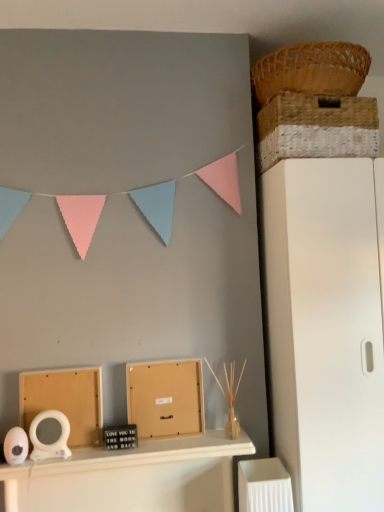
What do you see at coordinates (165, 398) in the screenshot? This screenshot has height=512, width=384. I see `matte cardboard box at center, acting as the first cardboard box starting from the right` at bounding box center [165, 398].

What do you see at coordinates (131, 477) in the screenshot?
I see `white glossy mirror at center` at bounding box center [131, 477].

I want to click on matte cardboard box at lower left, arranged as the second cardboard box when viewed from the right, so click(x=65, y=401).

Considering the points (77, 378) and (184, 422), which point is in front, point (77, 378) or point (184, 422)?

The point (77, 378) is in front.

Does matte cardboard box at lower left, arranged as the second cardboard box when viewed from the right, contain matte cardboard box at center, acting as the second cardboard box starting from the left?

No.

This screenshot has height=512, width=384. I want to click on cardboard box in front of the matte cardboard box at center, acting as the second cardboard box starting from the left, so click(65, 401).

Is matte cardboard box at center, acting as the first cardboard box starting from the right, to the right of white matte file cabinet at right from the viewer's perspective?

Incorrect, matte cardboard box at center, acting as the first cardboard box starting from the right, is not on the right side of white matte file cabinet at right.

Between matte cardboard box at center, acting as the first cardboard box starting from the right, and white matte file cabinet at right, which one has smaller size?

matte cardboard box at center, acting as the first cardboard box starting from the right.

Does matte cardboard box at lower left, which is the 1th cardboard box in left-to-right order, have a greater height compared to woven straw basket at upper right, the 1th basket ordered from the bottom?

Indeed, matte cardboard box at lower left, which is the 1th cardboard box in left-to-right order, has a greater height compared to woven straw basket at upper right, the 1th basket ordered from the bottom.

Looking at this image, from a real-world perspective, is matte cardboard box at lower left, arranged as the second cardboard box when viewed from the right, above or below woven straw basket at upper right, the 1th basket ordered from the bottom?

matte cardboard box at lower left, arranged as the second cardboard box when viewed from the right, is below woven straw basket at upper right, the 1th basket ordered from the bottom.

Considering the points (21, 404) and (295, 106), which point is behind, point (21, 404) or point (295, 106)?

Point (295, 106)

This screenshot has height=512, width=384. In order to click on basket that is the 1st one when counting upward from the matte cardboard box at lower left, arranged as the second cardboard box when viewed from the right (from the image's perspective) in this screenshot , I will do `click(315, 112)`.

Looking at this image, is woven brown basket at upper right, which is the 1th basket from top to bottom, behind white matte file cabinet at right?

Yes, it is behind white matte file cabinet at right.

From a real-world perspective, who is located lower, woven brown basket at upper right, which is the 1th basket from top to bottom, or white matte file cabinet at right?

white matte file cabinet at right, from a real-world perspective.

Considering the relative positions of woven brown basket at upper right, which is the 1th basket from top to bottom, and white matte file cabinet at right in the image provided, is woven brown basket at upper right, which is the 1th basket from top to bottom, to the right of white matte file cabinet at right from the viewer's perspective?

Incorrect, woven brown basket at upper right, which is the 1th basket from top to bottom, is not on the right side of white matte file cabinet at right.

Which is nearer, (340, 45) or (346, 348)?

Clearly, point (340, 45) is more distant from the camera than point (346, 348).

How different are the orientations of woven brown basket at upper right, which ranks as the second basket in bottom-to-top order, and matte cardboard box at lower left, arranged as the second cardboard box when viewed from the right, in degrees?

0.828 degrees separate the facing orientations of woven brown basket at upper right, which ranks as the second basket in bottom-to-top order, and matte cardboard box at lower left, arranged as the second cardboard box when viewed from the right.

Between woven brown basket at upper right, which is the 1th basket from top to bottom, and matte cardboard box at lower left, which is the 1th cardboard box in left-to-right order, which one has larger size?

woven brown basket at upper right, which is the 1th basket from top to bottom.

From the image's perspective, is woven brown basket at upper right, which is the 1th basket from top to bottom, located above matte cardboard box at lower left, arranged as the second cardboard box when viewed from the right?

Yes, from the image's perspective, woven brown basket at upper right, which is the 1th basket from top to bottom, is above matte cardboard box at lower left, arranged as the second cardboard box when viewed from the right.

Is woven brown basket at upper right, which is the 1th basket from top to bottom, oriented towards matte cardboard box at lower left, arranged as the second cardboard box when viewed from the right?

No, woven brown basket at upper right, which is the 1th basket from top to bottom, is not aimed at matte cardboard box at lower left, arranged as the second cardboard box when viewed from the right.

In the scene shown: Is the depth of matte cardboard box at center, acting as the first cardboard box starting from the right, less than that of woven straw basket at upper right, the 1th basket ordered from the bottom?

No.

The image size is (384, 512). In order to click on basket that is the 2nd one when counting rightward from the matte cardboard box at center, acting as the first cardboard box starting from the right in this screenshot , I will do coord(315,112).

Considering the relative sizes of matte cardboard box at center, acting as the first cardboard box starting from the right, and woven straw basket at upper right, which appears as the 2th basket when viewed from the top, in the image provided, is matte cardboard box at center, acting as the first cardboard box starting from the right, shorter than woven straw basket at upper right, which appears as the 2th basket when viewed from the top,?

No, matte cardboard box at center, acting as the first cardboard box starting from the right, is not shorter than woven straw basket at upper right, which appears as the 2th basket when viewed from the top.

Is matte cardboard box at center, acting as the second cardboard box starting from the left, wider or thinner than woven straw basket at upper right, which appears as the 2th basket when viewed from the top?

Considering their sizes, matte cardboard box at center, acting as the second cardboard box starting from the left, looks slimmer than woven straw basket at upper right, which appears as the 2th basket when viewed from the top.

From the image's perspective, which is above, matte cardboard box at center, acting as the first cardboard box starting from the right, or matte cardboard box at lower left, arranged as the second cardboard box when viewed from the right?

matte cardboard box at center, acting as the first cardboard box starting from the right, appears higher in the image.

Can you confirm if matte cardboard box at center, acting as the first cardboard box starting from the right, is taller than matte cardboard box at lower left, arranged as the second cardboard box when viewed from the right?

Incorrect, the height of matte cardboard box at center, acting as the first cardboard box starting from the right, is not larger of that of matte cardboard box at lower left, arranged as the second cardboard box when viewed from the right.

Looking at the image, does matte cardboard box at center, acting as the first cardboard box starting from the right, seem bigger or smaller compared to matte cardboard box at lower left, arranged as the second cardboard box when viewed from the right?

In the image, matte cardboard box at center, acting as the first cardboard box starting from the right, appears to be smaller than matte cardboard box at lower left, arranged as the second cardboard box when viewed from the right.

Is matte cardboard box at center, acting as the second cardboard box starting from the left, with matte cardboard box at lower left, which is the 1th cardboard box in left-to-right order?

There is a gap between matte cardboard box at center, acting as the second cardboard box starting from the left, and matte cardboard box at lower left, which is the 1th cardboard box in left-to-right order.

At what (x,y) coordinates should I click in order to perform the action: click on cardboard box above the matte cardboard box at lower left, which is the 1th cardboard box in left-to-right order (from the image's perspective). Please return your answer as a coordinate pair (x, y). Image resolution: width=384 pixels, height=512 pixels. Looking at the image, I should click on (165, 398).

Where is `cardboard box that is the 1st object located below the white matte file cabinet at right (from the image's perspective)`? The height and width of the screenshot is (512, 384). cardboard box that is the 1st object located below the white matte file cabinet at right (from the image's perspective) is located at coordinates (165, 398).

Looking at this image, considering their positions, is matte cardboard box at center, acting as the first cardboard box starting from the right, positioned closer to woven straw basket at upper right, which appears as the 2th basket when viewed from the top, than white matte file cabinet at right?

Based on the image, white matte file cabinet at right appears to be nearer to woven straw basket at upper right, which appears as the 2th basket when viewed from the top.

Based on their spatial positions, is woven straw basket at upper right, which appears as the 2th basket when viewed from the top, or matte cardboard box at center, acting as the second cardboard box starting from the left, closer to woven brown basket at upper right, which is the 1th basket from top to bottom?

woven straw basket at upper right, which appears as the 2th basket when viewed from the top, lies closer to woven brown basket at upper right, which is the 1th basket from top to bottom, than the other object.

Which object lies further to the anchor point matte cardboard box at lower left, arranged as the second cardboard box when viewed from the right, white matte file cabinet at right or white glossy mirror at center?

Based on the image, white matte file cabinet at right appears to be further to matte cardboard box at lower left, arranged as the second cardboard box when viewed from the right.

Based on their spatial positions, is white matte file cabinet at right or matte cardboard box at lower left, arranged as the second cardboard box when viewed from the right, further from woven straw basket at upper right, the 1th basket ordered from the bottom?

matte cardboard box at lower left, arranged as the second cardboard box when viewed from the right, lies further to woven straw basket at upper right, the 1th basket ordered from the bottom, than the other object.

Based on their spatial positions, is white glossy mirror at center or woven brown basket at upper right, which ranks as the second basket in bottom-to-top order, closer to white matte file cabinet at right?

The object closer to white matte file cabinet at right is white glossy mirror at center.

Based on the photo, looking at the image, which one is located closer to matte cardboard box at lower left, which is the 1th cardboard box in left-to-right order, white glossy mirror at center or white matte file cabinet at right?

Based on the image, white glossy mirror at center appears to be nearer to matte cardboard box at lower left, which is the 1th cardboard box in left-to-right order.

Based on their spatial positions, is white glossy mirror at center or matte cardboard box at lower left, arranged as the second cardboard box when viewed from the right, further from matte cardboard box at center, acting as the second cardboard box starting from the left?

Among the two, matte cardboard box at lower left, arranged as the second cardboard box when viewed from the right, is located further to matte cardboard box at center, acting as the second cardboard box starting from the left.

Based on their spatial positions, is white glossy mirror at center or woven brown basket at upper right, which is the 1th basket from top to bottom, closer to matte cardboard box at center, acting as the first cardboard box starting from the right?

white glossy mirror at center is positioned closer to the anchor matte cardboard box at center, acting as the first cardboard box starting from the right.

Where is `file cabinet between woven straw basket at upper right, the 1th basket ordered from the bottom, and white glossy mirror at center in the up-down direction`? Image resolution: width=384 pixels, height=512 pixels. file cabinet between woven straw basket at upper right, the 1th basket ordered from the bottom, and white glossy mirror at center in the up-down direction is located at coordinates (324, 330).

What are the coordinates of `file cabinet between woven brown basket at upper right, which ranks as the second basket in bottom-to-top order, and matte cardboard box at lower left, arranged as the second cardboard box when viewed from the right, from top to bottom` in the screenshot? It's located at (324, 330).

You are a GUI agent. You are given a task and a screenshot of the screen. Output one action in this format:
    pyautogui.click(x=<x>, y=<y>)
    Task: Click on the file cabinet between woven brown basket at upper right, which is the 1th basket from top to bottom, and matte cardboard box at center, acting as the first cardboard box starting from the right, in the up-down direction
    Image resolution: width=384 pixels, height=512 pixels.
    Given the screenshot: What is the action you would take?
    (x=324, y=330)

Locate an element on the screen. furniture situated between matte cardboard box at lower left, arranged as the second cardboard box when viewed from the right, and white matte file cabinet at right from left to right is located at coordinates (131, 477).